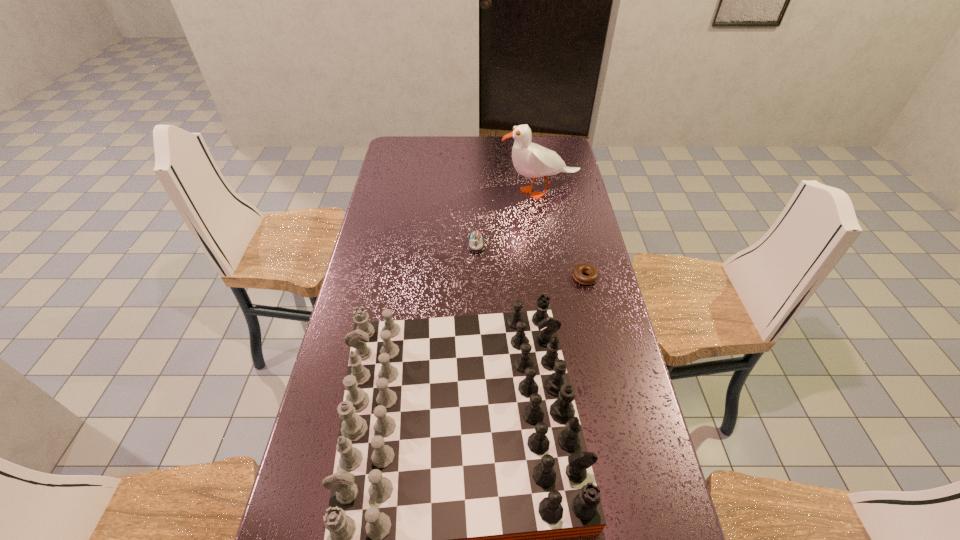
In order to click on object that is the closest to the gull in this screenshot , I will do `click(476, 244)`.

Locate an element on the screen. object identified as the closest to the third nearest object is located at coordinates (531, 160).

This screenshot has width=960, height=540. In order to click on free space that satisfies the following two spatial constraints: 1. on the wheel side of the computer mouse; 2. on the right side of the third farthest object in this screenshot , I will do `click(476, 278)`.

This screenshot has height=540, width=960. I want to click on vacant area in the image that satisfies the following two spatial constraints: 1. at the beak of the tallest object; 2. on the left side of the third farthest object, so click(x=554, y=278).

This screenshot has height=540, width=960. What are the coordinates of `blank area in the image that satisfies the following two spatial constraints: 1. on the wheel side of the second farthest object; 2. on the left side of the second nearest object` in the screenshot? It's located at (476, 278).

Locate an element on the screen. The height and width of the screenshot is (540, 960). free space that satisfies the following two spatial constraints: 1. at the beak of the doughnut; 2. on the right side of the tallest object is located at coordinates (554, 278).